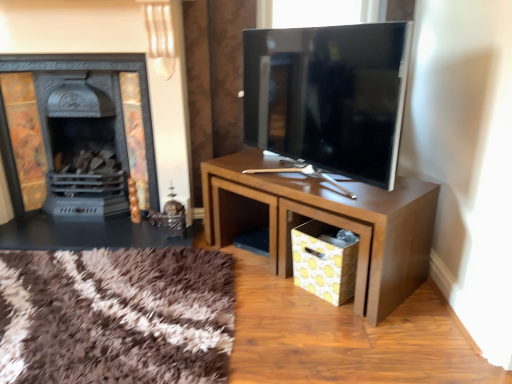
At what (x,y) coordinates should I click in order to perform the action: click on brown wood table at center. Please return your answer as a coordinate pair (x, y). The height and width of the screenshot is (384, 512). Looking at the image, I should click on (328, 222).

Image resolution: width=512 pixels, height=384 pixels. I want to click on yellow paper drawer at lower right, so click(x=329, y=224).

This screenshot has width=512, height=384. What are the coordinates of `matte black tv at center` in the screenshot? It's located at [x=328, y=96].

From a real-world perspective, which is physically above, matte black tv at center or yellow paper drawer at lower right?

matte black tv at center is physically above.

Does matte black tv at center have a smaller size compared to yellow paper drawer at lower right?

No, matte black tv at center is not smaller than yellow paper drawer at lower right.

Locate an element on the screen. Image resolution: width=512 pixels, height=384 pixels. television above the yellow paper drawer at lower right (from a real-world perspective) is located at coordinates (328, 96).

Which object is further away from the camera taking this photo, matte black tv at center or brown wood table at center?

brown wood table at center is behind.

Is matte black tv at center to the left of brown wood table at center from the viewer's perspective?

Correct, you'll find matte black tv at center to the left of brown wood table at center.

In the scene shown: From the image's perspective, between matte black tv at center and brown wood table at center, which one is located above?

matte black tv at center is shown above in the image.

Considering the positions of point (346, 100) and point (234, 230), is point (346, 100) closer or farther from the camera than point (234, 230)?

Point (346, 100) is positioned closer to the camera compared to point (234, 230).

Consider the image. From the image's perspective, which one is positioned lower, yellow paper drawer at lower right or matte black tv at center?

From the image's view, yellow paper drawer at lower right is below.

Is yellow paper drawer at lower right looking in the opposite direction of matte black tv at center?

That's not correct — yellow paper drawer at lower right is not looking away from matte black tv at center.

Would you consider yellow paper drawer at lower right to be distant from matte black tv at center?

No, yellow paper drawer at lower right is not far away from matte black tv at center.

Does point (280, 201) appear closer or farther from the camera than point (295, 100)?

Point (280, 201).

Does brown wood table at center have a greater height compared to black matte fireplace at left?

No, brown wood table at center is not taller than black matte fireplace at left.

Considering the sizes of brown wood table at center and black matte fireplace at left in the image, is brown wood table at center bigger or smaller than black matte fireplace at left?

Clearly, brown wood table at center is smaller in size than black matte fireplace at left.

Is brown wood table at center inside or outside of black matte fireplace at left?

brown wood table at center cannot be found inside black matte fireplace at left.

Between brown wood table at center and black matte fireplace at left, which one is positioned in front?

Positioned in front is brown wood table at center.

Can black matte fireplace at left be found inside matte black tv at center?

No, black matte fireplace at left is located outside of matte black tv at center.

From the image's perspective, is matte black tv at center located above or below black matte fireplace at left?

Clearly, from the image's perspective, matte black tv at center is above black matte fireplace at left.

Can you confirm if matte black tv at center is positioned to the right of black matte fireplace at left?

Yes, matte black tv at center is to the right of black matte fireplace at left.

Is point (360, 240) closer to camera compared to point (97, 36)?

Yes, point (360, 240) is closer to viewer.

Can you tell me how much yellow paper drawer at lower right and black matte fireplace at left differ in facing direction?

The angular difference between yellow paper drawer at lower right and black matte fireplace at left is 41.9 degrees.

Is yellow paper drawer at lower right wider than black matte fireplace at left?

Yes, yellow paper drawer at lower right is wider than black matte fireplace at left.

From the image's perspective, would you say yellow paper drawer at lower right is shown under black matte fireplace at left?

Yes, from the image's perspective, yellow paper drawer at lower right is beneath black matte fireplace at left.

Is brown wood table at center inside or outside of matte black tv at center?

brown wood table at center is not inside matte black tv at center, it's outside.

Locate an element on the screen. Image resolution: width=512 pixels, height=384 pixels. table on the right of matte black tv at center is located at coordinates (328, 222).

Is brown wood table at center positioned far away from matte black tv at center?

No.

From the picture: From the image's perspective, relative to matte black tv at center, is brown wood table at center above or below?

Clearly, from the image's perspective, brown wood table at center is below matte black tv at center.

Find the location of `drawer below the matte black tv at center (from a real-world perspective)`. drawer below the matte black tv at center (from a real-world perspective) is located at coordinates (329, 224).

In order to click on television above the brown wood table at center (from the image's perspective) in this screenshot , I will do `click(328, 96)`.

When comparing their distances from yellow paper drawer at lower right, does black matte fireplace at left or brown wood table at center seem further?

The object further to yellow paper drawer at lower right is black matte fireplace at left.

Looking at the image, which one is located closer to matte black tv at center, yellow paper drawer at lower right or black matte fireplace at left?

The object closer to matte black tv at center is yellow paper drawer at lower right.

Based on their spatial positions, is yellow paper drawer at lower right or matte black tv at center closer to brown wood table at center?

yellow paper drawer at lower right is positioned closer to the anchor brown wood table at center.

When comparing their distances from brown wood table at center, does black matte fireplace at left or matte black tv at center seem closer?

matte black tv at center is closer to brown wood table at center.

Which object lies further to the anchor point yellow paper drawer at lower right, matte black tv at center or black matte fireplace at left?

Based on the image, black matte fireplace at left appears to be further to yellow paper drawer at lower right.

When comparing their distances from matte black tv at center, does brown wood table at center or yellow paper drawer at lower right seem closer?

Based on the image, brown wood table at center appears to be nearer to matte black tv at center.

When comparing their distances from yellow paper drawer at lower right, does black matte fireplace at left or matte black tv at center seem closer?

Based on the image, matte black tv at center appears to be nearer to yellow paper drawer at lower right.

Based on their spatial positions, is matte black tv at center or black matte fireplace at left closer to brown wood table at center?

Among the two, matte black tv at center is located nearer to brown wood table at center.

This screenshot has width=512, height=384. I want to click on television between black matte fireplace at left and yellow paper drawer at lower right in the horizontal direction, so click(328, 96).

What are the coordinates of `table between black matte fireplace at left and yellow paper drawer at lower right` in the screenshot? It's located at (328, 222).

What are the coordinates of `television between black matte fireplace at left and brown wood table at center` in the screenshot? It's located at (328, 96).

The height and width of the screenshot is (384, 512). In order to click on table between matte black tv at center and yellow paper drawer at lower right in the vertical direction in this screenshot , I will do `click(328, 222)`.